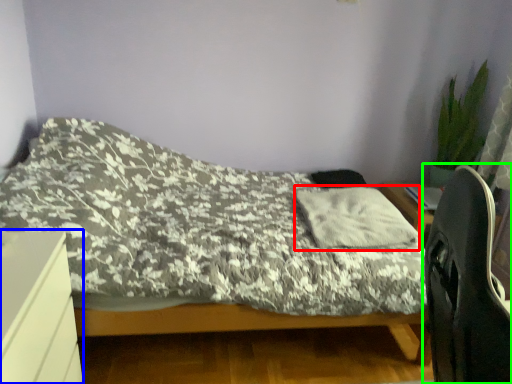
Question: Which is nearer to the pillow (highlighted by a red box)? desk (highlighted by a blue box) or computer chair (highlighted by a green box).

Choices:
 (A) desk
 (B) computer chair

Answer: (B)